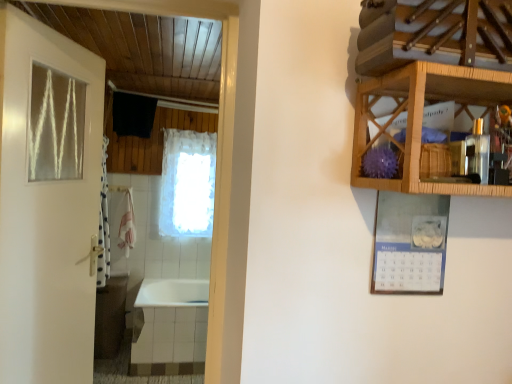
Question: Is clear glass window at upper left aimed at white lace curtain at center?

Choices:
 (A) yes
 (B) no

Answer: (B)

Question: From a real-world perspective, is clear glass window at upper left physically above white lace curtain at center?

Choices:
 (A) yes
 (B) no

Answer: (A)

Question: Is clear glass window at upper left smaller than white lace curtain at center?

Choices:
 (A) no
 (B) yes

Answer: (B)

Question: Does clear glass window at upper left have a larger size compared to white lace curtain at center?

Choices:
 (A) yes
 (B) no

Answer: (B)

Question: Is clear glass window at upper left further to camera compared to white lace curtain at center?

Choices:
 (A) no
 (B) yes

Answer: (A)

Question: Would you say white paper calendar at upper right is to the left or to the right of clear glass window at upper left in the picture?

Choices:
 (A) right
 (B) left

Answer: (A)

Question: From the image's perspective, is white paper calendar at upper right located above or below clear glass window at upper left?

Choices:
 (A) above
 (B) below

Answer: (B)

Question: From a real-world perspective, is white paper calendar at upper right physically located above or below clear glass window at upper left?

Choices:
 (A) below
 (B) above

Answer: (A)

Question: In the image, is white paper calendar at upper right positioned in front of or behind clear glass window at upper left?

Choices:
 (A) behind
 (B) front

Answer: (B)

Question: Is wooden cabinet at upper right in front of or behind white glossy bathtub at lower left in the image?

Choices:
 (A) front
 (B) behind

Answer: (A)

Question: Based on their positions, is wooden cabinet at upper right located to the left or right of white glossy bathtub at lower left?

Choices:
 (A) right
 (B) left

Answer: (A)

Question: From a real-world perspective, relative to white glossy bathtub at lower left, is wooden cabinet at upper right vertically above or below?

Choices:
 (A) below
 (B) above

Answer: (B)

Question: Do you think wooden cabinet at upper right is within white glossy bathtub at lower left, or outside of it?

Choices:
 (A) inside
 (B) outside

Answer: (B)

Question: From the image's perspective, is white glossy bathtub at lower left positioned above or below white paper calendar at upper right?

Choices:
 (A) above
 (B) below

Answer: (B)

Question: Looking at their shapes, would you say white glossy bathtub at lower left is wider or thinner than white paper calendar at upper right?

Choices:
 (A) wide
 (B) thin

Answer: (A)